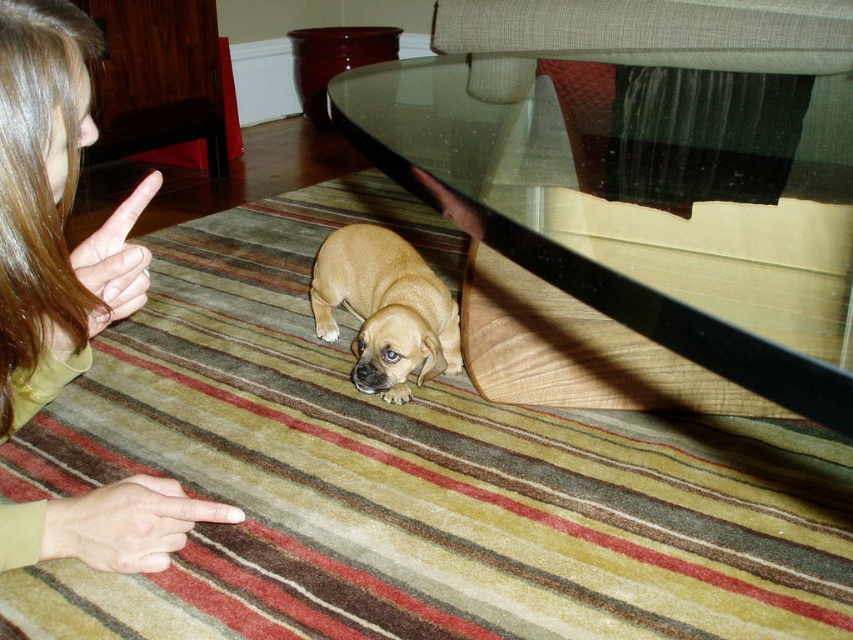
Question: Is smooth green shirt at lower left positioned in front of light brown fur at center?

Choices:
 (A) yes
 (B) no

Answer: (A)

Question: Which object is positioned closest to the light brown fur at center?

Choices:
 (A) transparent glass table at lower center
 (B) smooth green shirt at lower left
 (C) light brown skin at upper left
 (D) smooth beige hand at lower left

Answer: (A)

Question: Among these points, which one is farthest from the camera?

Choices:
 (A) (477, 232)
 (B) (45, 348)

Answer: (A)

Question: Among these objects, which one is nearest to the camera?

Choices:
 (A) smooth green shirt at lower left
 (B) smooth beige hand at lower left

Answer: (A)

Question: Where is transparent glass table at lower center located in relation to smooth beige hand at lower left in the image?

Choices:
 (A) right
 (B) left

Answer: (A)

Question: Can you confirm if light brown fur at center is wider than light brown skin at upper left?

Choices:
 (A) no
 (B) yes

Answer: (B)